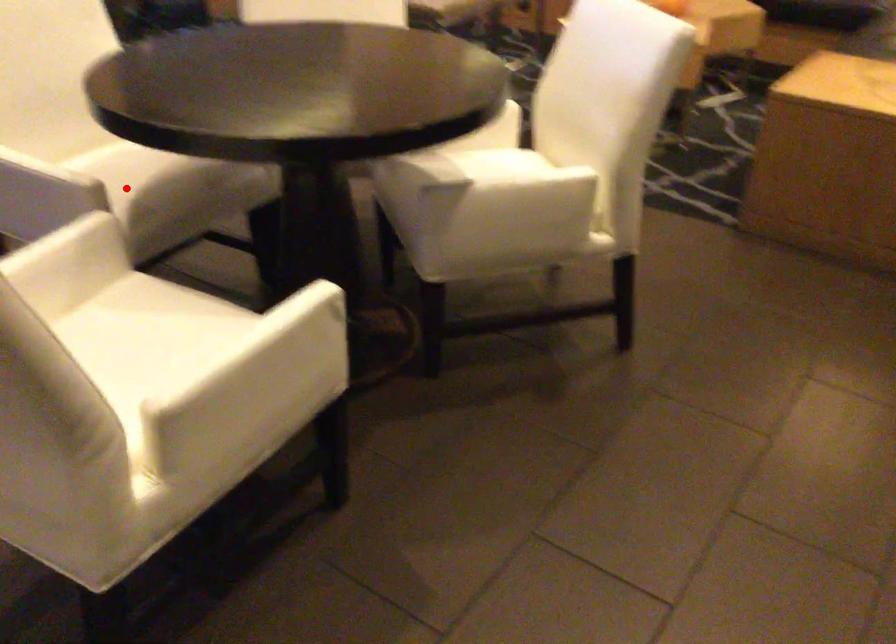
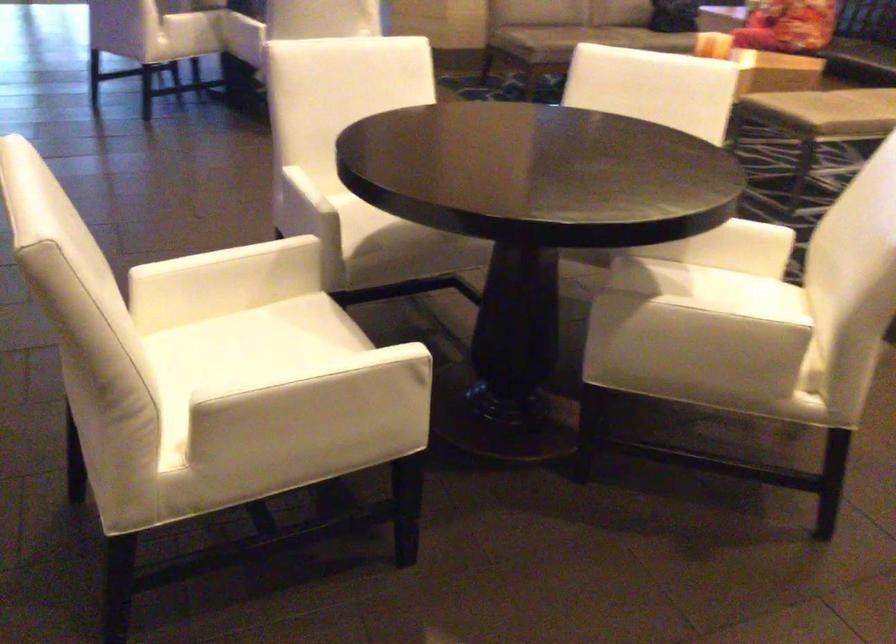
Question: I am providing you with two images of the same scene from different viewpoints. A red point is shown in image1. For the corresponding object point in image2, is it positioned nearer or farther from the camera?

Choices:
 (A) Nearer
 (B) Farther

Answer: (B)